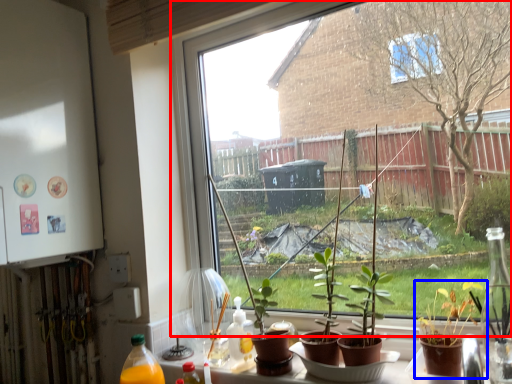
Question: Which object appears closest to the camera in this image, window (highlighted by a red box) or houseplant (highlighted by a blue box)?

Choices:
 (A) window
 (B) houseplant

Answer: (B)